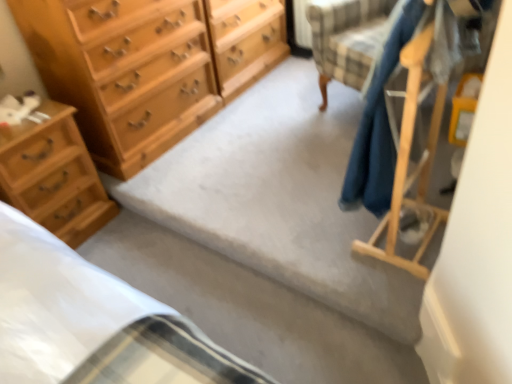
Question: Is wooden coat rack at right not close to light brown wood chest of drawers at left, the 1th chest of drawers from the bottom?

Choices:
 (A) yes
 (B) no

Answer: (A)

Question: Is wooden coat rack at right not within light brown wood chest of drawers at left, the 1th chest of drawers from the bottom?

Choices:
 (A) no
 (B) yes

Answer: (B)

Question: Is wooden coat rack at right closer to the viewer compared to light brown wood chest of drawers at left, the second chest of drawers in the top-to-bottom sequence?

Choices:
 (A) yes
 (B) no

Answer: (A)

Question: Does wooden coat rack at right have a larger size compared to light brown wood chest of drawers at left, the 1th chest of drawers from the bottom?

Choices:
 (A) no
 (B) yes

Answer: (B)

Question: From a real-world perspective, is wooden coat rack at right under light brown wood chest of drawers at left, the 1th chest of drawers from the bottom?

Choices:
 (A) no
 (B) yes

Answer: (A)

Question: From a real-world perspective, is light brown wood chest of drawers at left, the second chest of drawers in the top-to-bottom sequence, positioned above or below wooden coat rack at right?

Choices:
 (A) below
 (B) above

Answer: (A)

Question: Based on their sizes in the image, would you say light brown wood chest of drawers at left, the second chest of drawers in the top-to-bottom sequence, is bigger or smaller than wooden coat rack at right?

Choices:
 (A) small
 (B) big

Answer: (A)

Question: In the image, is light brown wood chest of drawers at left, the 1th chest of drawers from the bottom, positioned in front of or behind wooden coat rack at right?

Choices:
 (A) front
 (B) behind

Answer: (B)

Question: Does point click(112, 208) appear closer or farther from the camera than point click(437, 89)?

Choices:
 (A) farther
 (B) closer

Answer: (A)

Question: From their relative heights in the image, would you say wooden coat rack at right is taller or shorter than carpet at center?

Choices:
 (A) short
 (B) tall

Answer: (B)

Question: Looking at their shapes, would you say wooden coat rack at right is wider or thinner than carpet at center?

Choices:
 (A) wide
 (B) thin

Answer: (B)

Question: In the image, is wooden coat rack at right on the left side or the right side of carpet at center?

Choices:
 (A) left
 (B) right

Answer: (B)

Question: Which is correct: wooden coat rack at right is inside carpet at center, or outside of it?

Choices:
 (A) inside
 (B) outside

Answer: (B)

Question: From the image's perspective, is carpet at center positioned above or below wooden coat rack at right?

Choices:
 (A) above
 (B) below

Answer: (A)

Question: From a real-world perspective, is carpet at center positioned above or below wooden coat rack at right?

Choices:
 (A) below
 (B) above

Answer: (A)